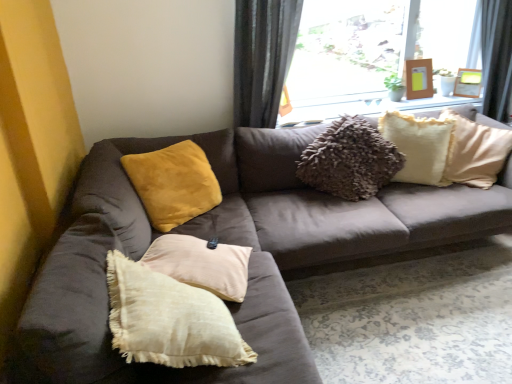
Question: Can you confirm if transparent glass window at upper center is shorter than wooden picture frame at upper right, the second picture frame when ordered from right to left?

Choices:
 (A) yes
 (B) no

Answer: (B)

Question: Is wooden picture frame at upper right, the second picture frame when ordered from right to left, inside transparent glass window at upper center?

Choices:
 (A) no
 (B) yes

Answer: (A)

Question: From a real-world perspective, is transparent glass window at upper center on wooden picture frame at upper right, the second picture frame when ordered from right to left?

Choices:
 (A) no
 (B) yes

Answer: (B)

Question: Does transparent glass window at upper center have a larger size compared to wooden picture frame at upper right, the second picture frame when ordered from right to left?

Choices:
 (A) no
 (B) yes

Answer: (B)

Question: Is transparent glass window at upper center outside of wooden picture frame at upper right, which ranks as the 1th picture frame in left-to-right order?

Choices:
 (A) no
 (B) yes

Answer: (B)

Question: From a real-world perspective, is gray fabric curtain at upper center physically located above or below fuzzy cream pillow at upper right, which is the 1th pillow from right to left?

Choices:
 (A) below
 (B) above

Answer: (B)

Question: In the image, is gray fabric curtain at upper center positioned in front of or behind fuzzy cream pillow at upper right, which is the 1th pillow from right to left?

Choices:
 (A) front
 (B) behind

Answer: (A)

Question: In terms of height, does gray fabric curtain at upper center look taller or shorter compared to fuzzy cream pillow at upper right, which is the 1th pillow from right to left?

Choices:
 (A) tall
 (B) short

Answer: (A)

Question: Looking at their shapes, would you say gray fabric curtain at upper center is wider or thinner than fuzzy cream pillow at upper right, which is the 1th pillow from right to left?

Choices:
 (A) wide
 (B) thin

Answer: (A)

Question: Considering the positions of transparent glass window at upper center and gray fabric curtain at upper center in the image, is transparent glass window at upper center bigger or smaller than gray fabric curtain at upper center?

Choices:
 (A) big
 (B) small

Answer: (A)

Question: Considering the positions of transparent glass window at upper center and gray fabric curtain at upper center in the image, is transparent glass window at upper center wider or thinner than gray fabric curtain at upper center?

Choices:
 (A) thin
 (B) wide

Answer: (B)

Question: Is point (379, 26) closer or farther from the camera than point (279, 89)?

Choices:
 (A) farther
 (B) closer

Answer: (A)

Question: Considering their positions, is transparent glass window at upper center located in front of or behind gray fabric curtain at upper center?

Choices:
 (A) front
 (B) behind

Answer: (B)

Question: In terms of size, does velvet yellow pillow at upper left, the 1th pillow when ordered from left to right, appear bigger or smaller than wooden picture frame at upper right, which ranks as the 1th picture frame in left-to-right order?

Choices:
 (A) small
 (B) big

Answer: (B)

Question: From a real-world perspective, is velvet yellow pillow at upper left, marked as the 2th pillow in a right-to-left arrangement, physically located above or below wooden picture frame at upper right, which ranks as the 1th picture frame in left-to-right order?

Choices:
 (A) above
 (B) below

Answer: (B)